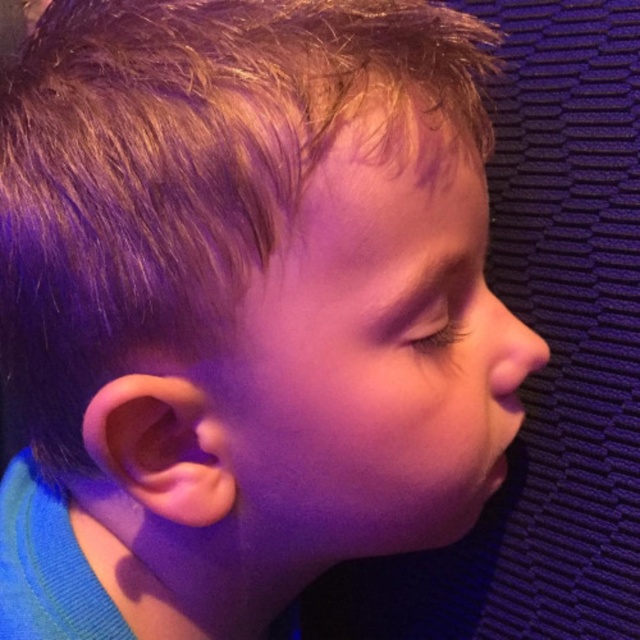
Is blonde smooth hair at upper left bigger than smooth skin face at center?

Indeed, blonde smooth hair at upper left has a larger size compared to smooth skin face at center.

Does point (228, 52) lie behind point (436, 381)?

No, it is not.

I want to click on blonde smooth hair at upper left, so click(x=180, y=164).

Is point (433, 16) positioned before point (499, 371)?

Yes.

Looking at this image, can you confirm if blonde smooth hair at upper left is taller than smooth flesh nose at right?

Correct, blonde smooth hair at upper left is much taller as smooth flesh nose at right.

Which is in front, point (125, 106) or point (486, 355)?

Point (125, 106)

Locate an element on the screen. blonde smooth hair at upper left is located at coordinates (180, 164).

This screenshot has height=640, width=640. What do you see at coordinates (364, 353) in the screenshot?
I see `smooth skin face at center` at bounding box center [364, 353].

Is smooth skin face at center behind smooth flesh nose at right?

No, smooth skin face at center is in front of smooth flesh nose at right.

Does point (298, 228) come farther from viewer compared to point (522, 372)?

No, it is in front of (522, 372).

Locate an element on the screen. The height and width of the screenshot is (640, 640). smooth skin face at center is located at coordinates (364, 353).